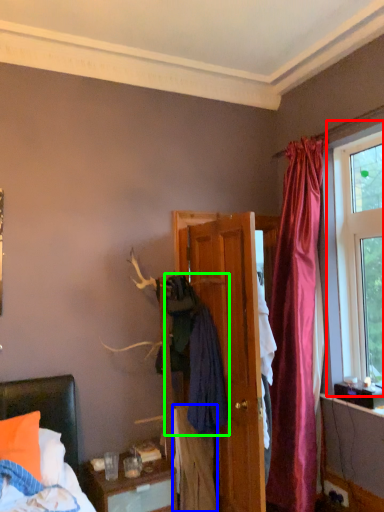
Question: Based on their relative distances, which object is farther from window (highlighted by a red box)? Choose from clothing (highlighted by a blue box) and clothing (highlighted by a green box).

Choices:
 (A) clothing
 (B) clothing

Answer: (A)